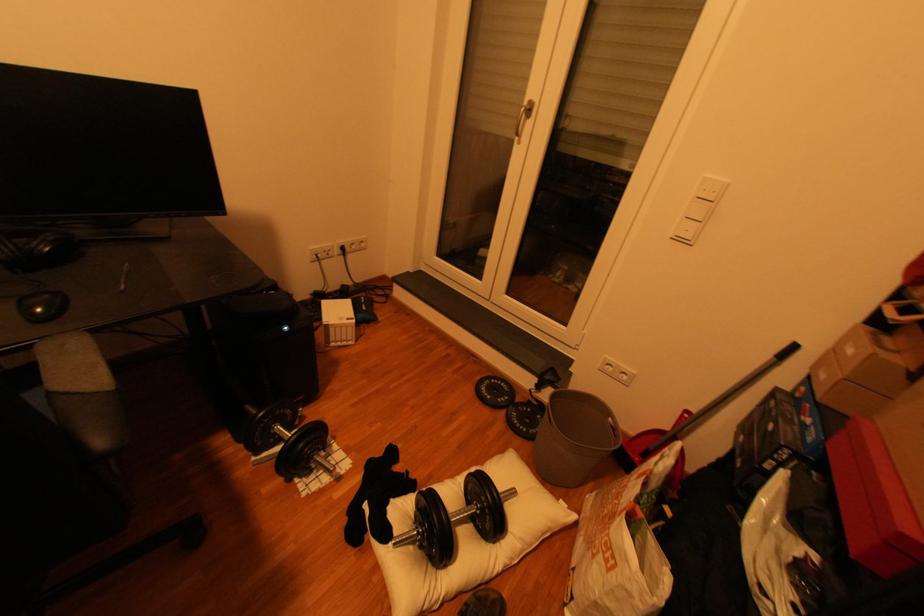
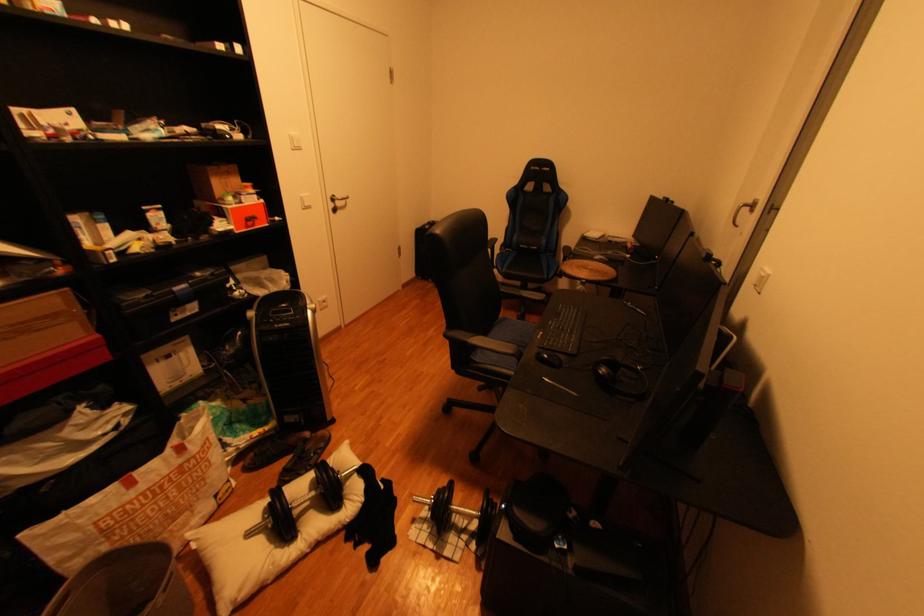
Find the pixel in the second image that matches point (45, 312) in the first image.

(555, 357)